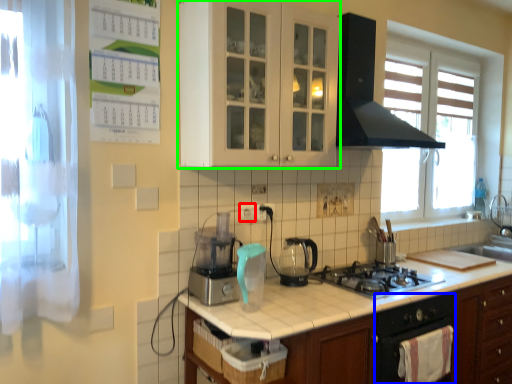
Question: Estimate the real-world distances between objects in this image. Which object is closer to electric outlet (highlighted by a red box), oven (highlighted by a blue box) or cabinetry (highlighted by a green box)?

Choices:
 (A) oven
 (B) cabinetry

Answer: (B)